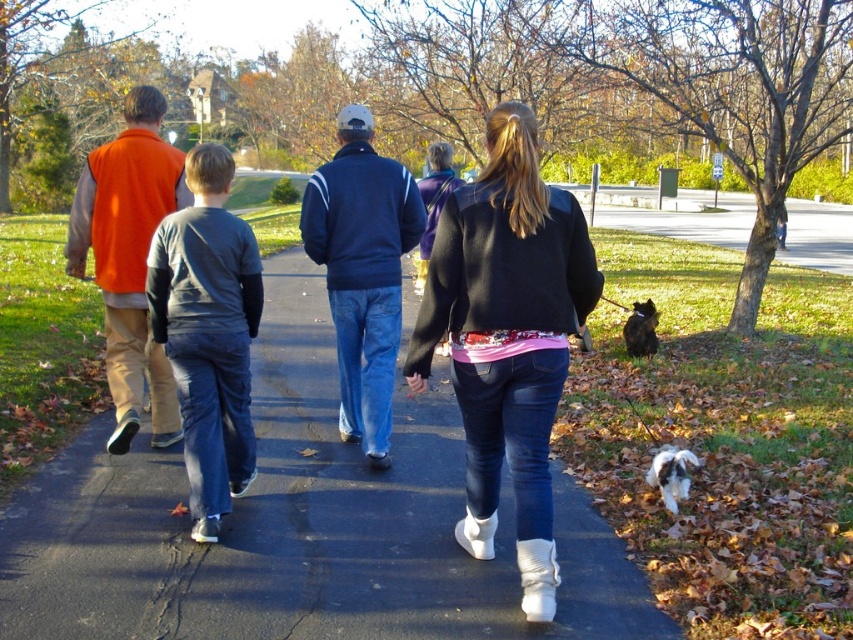
Question: Which is farther from the white fluffy dog at lower right?

Choices:
 (A) black leather jacket at center
 (B) orange fleece vest at left
 (C) black asphalt pavement at center
 (D) navy blue jacket at center

Answer: (B)

Question: Does black leather jacket at center appear under orange fleece vest at left?

Choices:
 (A) no
 (B) yes

Answer: (B)

Question: Which object is closer to the camera taking this photo?

Choices:
 (A) navy blue jacket at center
 (B) orange fleece vest at left
 (C) black fur dog at lower right
 (D) black leather jacket at center

Answer: (D)

Question: Which point is farther to the camera?

Choices:
 (A) (358, 412)
 (B) (123, 216)
 (C) (664, 474)
 (D) (646, 326)

Answer: (D)

Question: Observing the image, what is the correct spatial positioning of black asphalt pavement at center in reference to navy blue jacket at center?

Choices:
 (A) above
 (B) below

Answer: (B)

Question: Is black asphalt pavement at center positioned at the back of orange fleece vest at left?

Choices:
 (A) no
 (B) yes

Answer: (A)